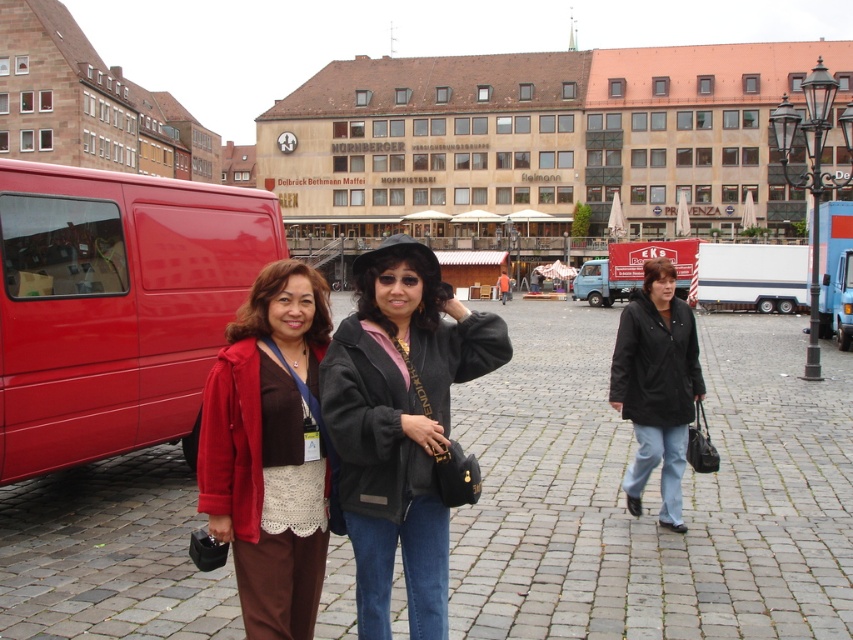
You are a photographer standing in the city square and want to take a photo of the matte red van at left and the matte brown pants at center. Which object is located to the right of the other?

The matte brown pants at center is located to the right of the matte red van at left.

You are a delivery driver who needs to park your 1.8 meters tall truck near the matte red van at left and the black leather jacket at center. Which object should you avoid hitting because it is taller than your truck?

The matte red van at left is taller than the black leather jacket at center, so you should avoid hitting the matte red van at left as it is taller than your truck.